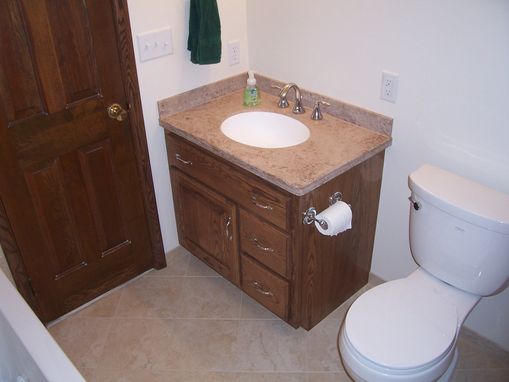
Locate an element on the screen. light switch is located at coordinates (152, 49).